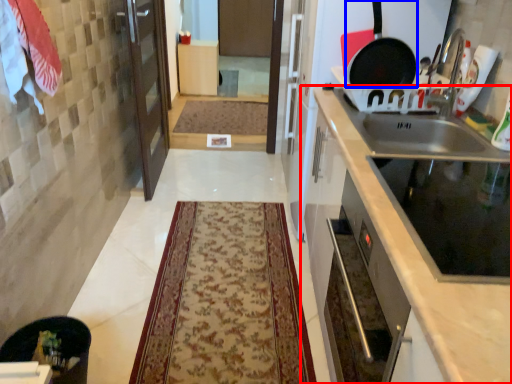
Question: Which of the following is the closest to the observer, cabinetry (highlighted by a red box) or frying pan (highlighted by a blue box)?

Choices:
 (A) cabinetry
 (B) frying pan

Answer: (A)